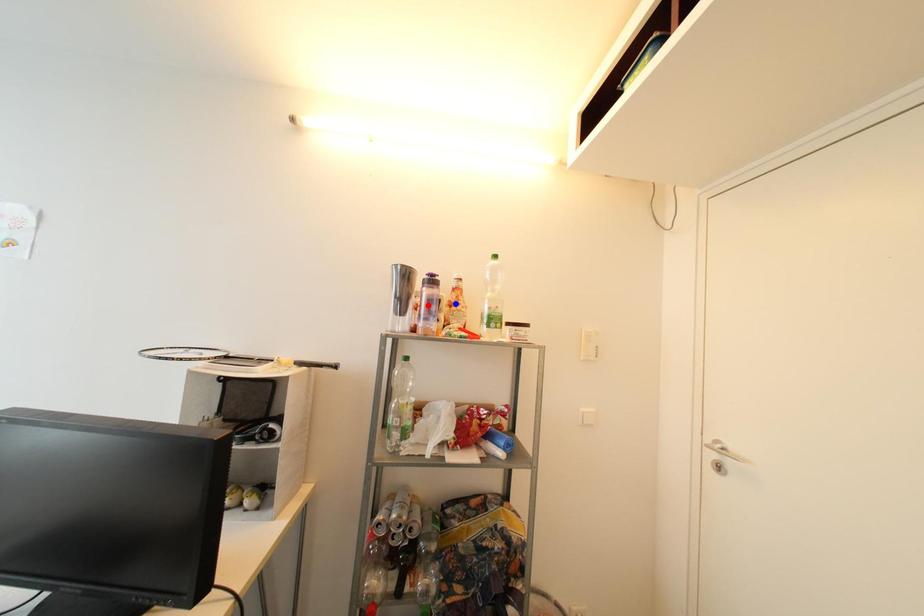
Question: Two points are marked on the image. Which point is closer to the camera?

Choices:
 (A) Blue point is closer.
 (B) Red point is closer.

Answer: (B)